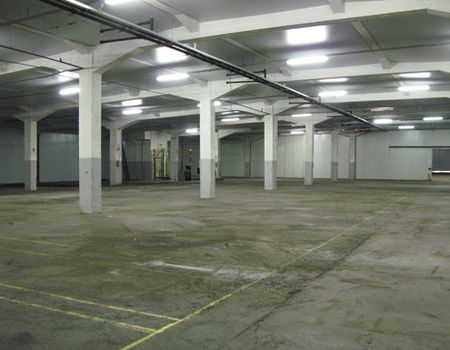
Identify the location of gray door. Image resolution: width=450 pixels, height=350 pixels. (438, 166).